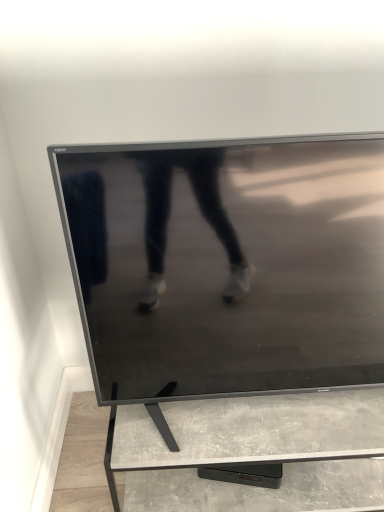
The image size is (384, 512). I want to click on matte gray table at center, so click(x=254, y=451).

Describe the element at coordinates (254, 451) in the screenshot. I see `matte gray table at center` at that location.

The height and width of the screenshot is (512, 384). I want to click on matte gray table at center, so click(254, 451).